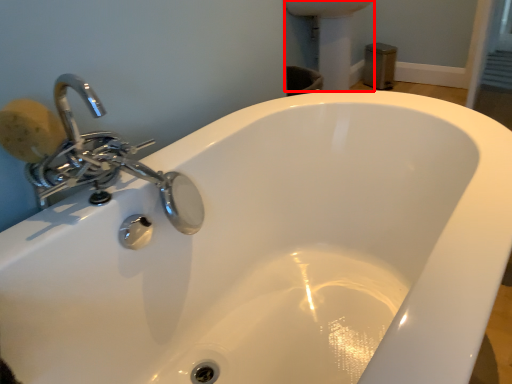
Question: From the image's perspective, what is the correct spatial relationship of porcelain (annotated by the red box) in relation to soap?

Choices:
 (A) above
 (B) below

Answer: (A)